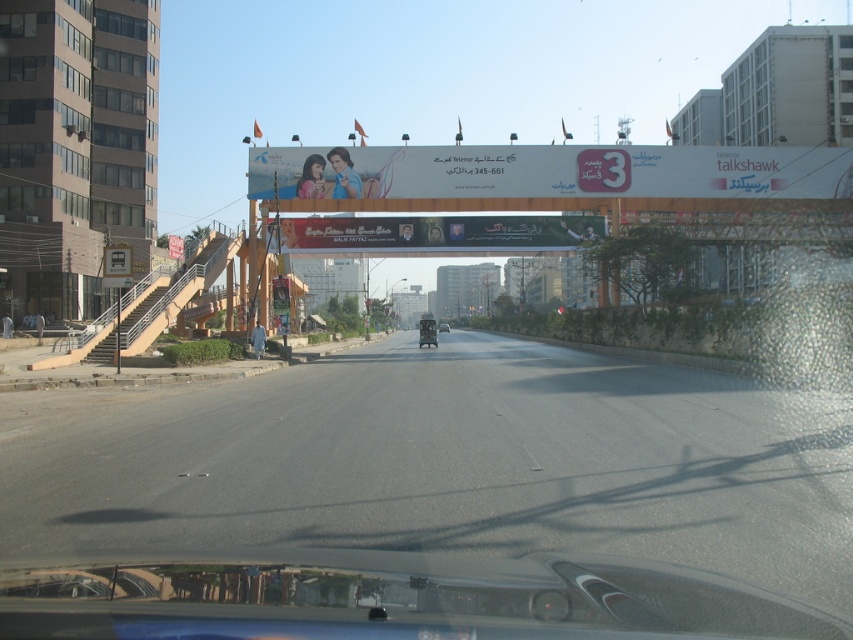
Is asphalt road at center below transparent glass windshield at center?

Yes, asphalt road at center is below transparent glass windshield at center.

Can you confirm if asphalt road at center is positioned above transparent glass windshield at center?

Incorrect, asphalt road at center is not positioned above transparent glass windshield at center.

Does point (386, 442) come farther from viewer compared to point (796, 624)?

That is True.

Identify the location of asphalt road at center. (445, 461).

Between transparent glass windshield at center and metallic silver car at center, which one appears on the right side from the viewer's perspective?

metallic silver car at center is more to the right.

Which is in front, point (50, 593) or point (445, 330)?

Point (50, 593)

This screenshot has width=853, height=640. I want to click on transparent glass windshield at center, so pyautogui.click(x=389, y=600).

Where is `transparent glass windshield at center`? The height and width of the screenshot is (640, 853). transparent glass windshield at center is located at coordinates (389, 600).

Between point (808, 499) and point (438, 330), which one is positioned behind?

The point (438, 330) is more distant.

What do you see at coordinates (445, 461) in the screenshot? The height and width of the screenshot is (640, 853). I see `asphalt road at center` at bounding box center [445, 461].

Identify the location of asphalt road at center. (445, 461).